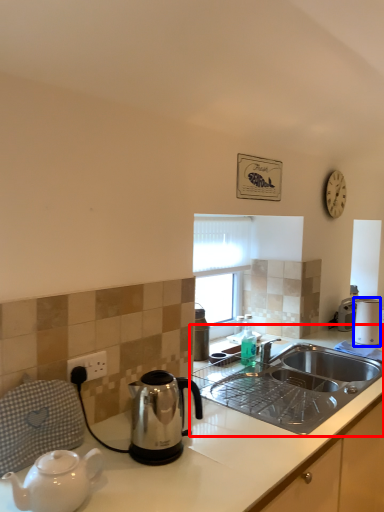
Question: Which of the following is the farthest to the observer, countertop (highlighted by a red box) or toaster (highlighted by a blue box)?

Choices:
 (A) countertop
 (B) toaster

Answer: (B)